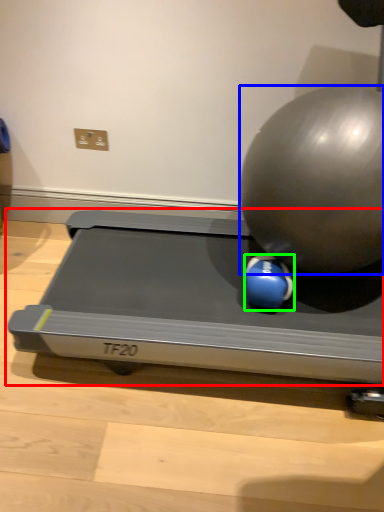
Question: Which is farther away from treadmill (highlighted by a red box)? ball (highlighted by a blue box) or ball (highlighted by a green box)?

Choices:
 (A) ball
 (B) ball

Answer: (A)